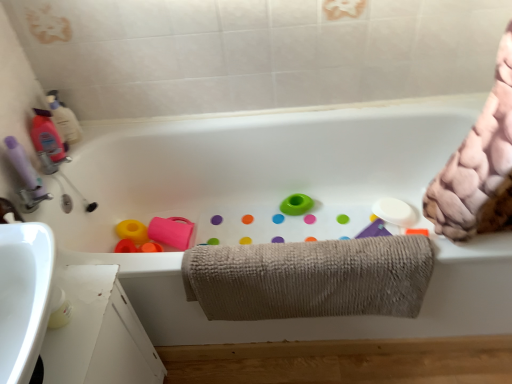
Question: Is beige textured towel at center situated inside purple matte bottle at left, which ranks as the first cleaning product in bottom-to-top order, or outside?

Choices:
 (A) inside
 (B) outside

Answer: (B)

Question: Based on their sizes in the image, would you say beige textured towel at center is bigger or smaller than purple matte bottle at left, which ranks as the first cleaning product in bottom-to-top order?

Choices:
 (A) small
 (B) big

Answer: (B)

Question: Estimate the real-world distances between objects in this image. Which object is farther from the white ceramic bathtub at center?

Choices:
 (A) purple matte bottle at left, marked as the third cleaning product in a top-to-bottom arrangement
 (B) translucent plastic bottle at upper left, arranged as the 1th cleaning product when viewed from the top
 (C) beige textured towel at center
 (D) matte pink bottle at left, the 2th cleaning product positioned from the top

Answer: (A)

Question: Based on their relative distances, which object is nearer to the matte pink bottle at left, acting as the 2th cleaning product starting from the bottom?

Choices:
 (A) beige textured towel at center
 (B) white ceramic bathtub at center
 (C) translucent plastic bottle at upper left, which ranks as the third cleaning product in bottom-to-top order
 (D) purple matte bottle at left, which ranks as the first cleaning product in bottom-to-top order

Answer: (C)